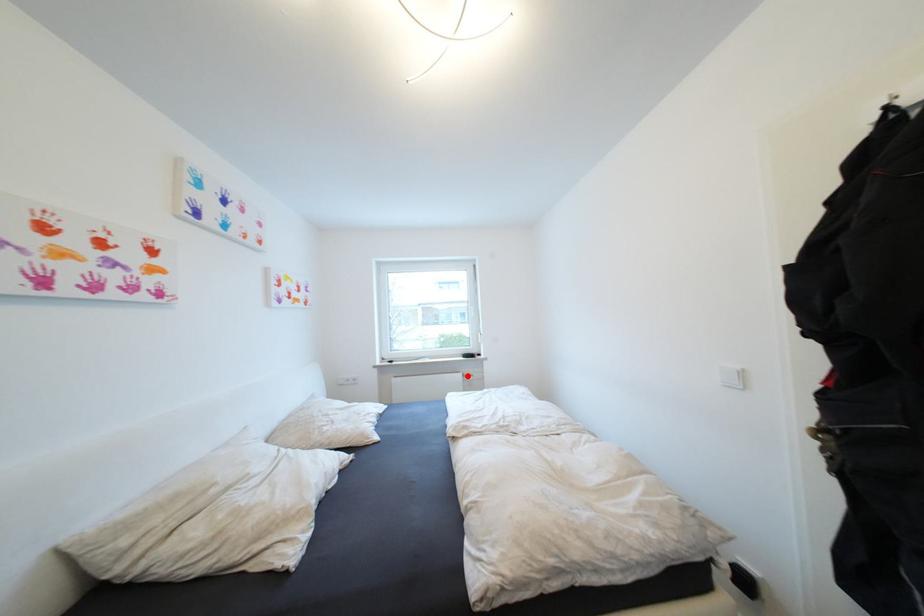
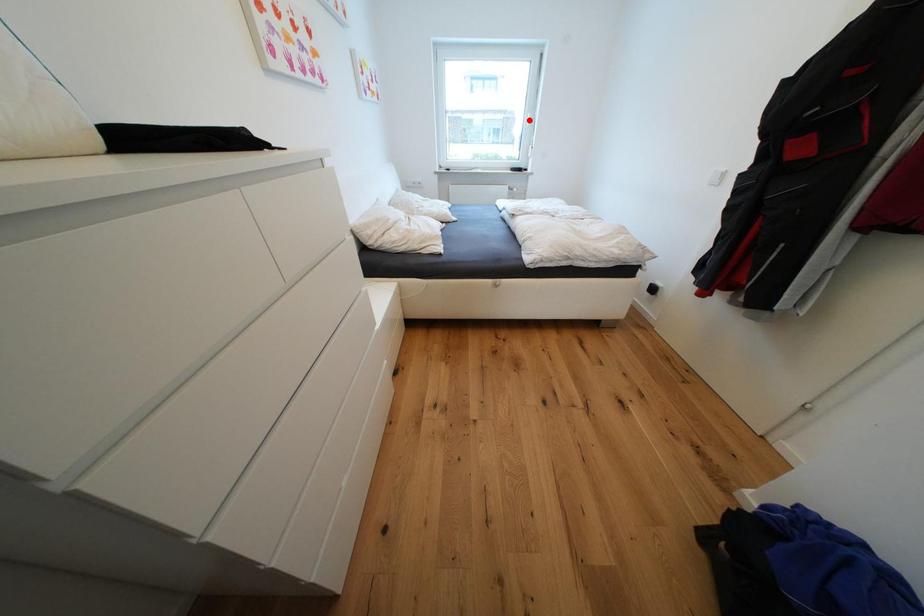
I am providing you with two images of the same scene from different viewpoints. A red point is marked on the first image and another point is marked on the second image. Does the point marked in image1 correspond to the same location as the one in image2?

No